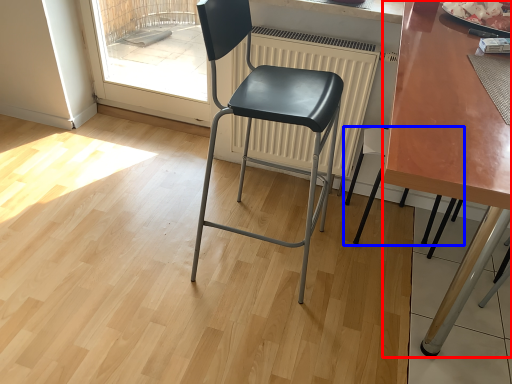
Question: Which object appears closest to the camera in this image, table (highlighted by a red box) or chair (highlighted by a blue box)?

Choices:
 (A) table
 (B) chair

Answer: (A)